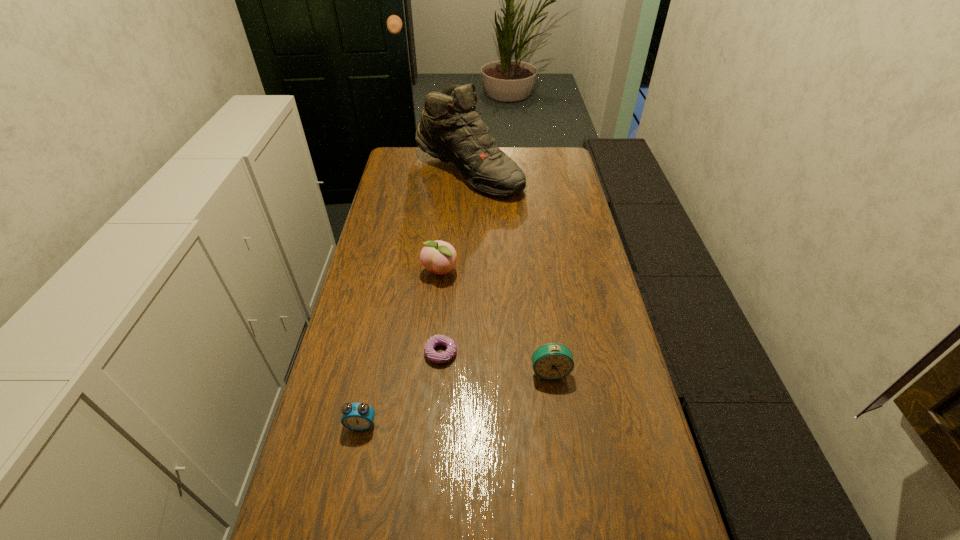
This screenshot has height=540, width=960. In the image, there is a desktop. Find the location of `vacant space at the far right corner`. vacant space at the far right corner is located at coordinates (536, 162).

At what (x,y) coordinates should I click in order to perform the action: click on free spot between the doughnut and the second farthest object. Please return your answer as a coordinate pair (x, y). Looking at the image, I should click on (440, 313).

At what (x,y) coordinates should I click in order to perform the action: click on free area in between the second farthest object and the doughnut. Please return your answer as a coordinate pair (x, y). This screenshot has height=540, width=960. Looking at the image, I should click on (440, 313).

I want to click on free space between the second farthest object and the left alarm clock, so pyautogui.click(x=400, y=348).

Where is `vacant area that lies between the taller alarm clock and the farthest object`? This screenshot has width=960, height=540. vacant area that lies between the taller alarm clock and the farthest object is located at coordinates (509, 272).

I want to click on vacant area that lies between the farthest object and the taller alarm clock, so click(x=509, y=272).

Where is `vacant space that's between the right alarm clock and the left alarm clock`? vacant space that's between the right alarm clock and the left alarm clock is located at coordinates (456, 398).

This screenshot has height=540, width=960. In order to click on free point between the fourth nearest object and the shortest object in this screenshot , I will do `click(440, 313)`.

Image resolution: width=960 pixels, height=540 pixels. I want to click on vacant space in between the nearest object and the farther alarm clock, so click(x=456, y=398).

Where is `vacant space in between the left alarm clock and the second farthest object`? Image resolution: width=960 pixels, height=540 pixels. vacant space in between the left alarm clock and the second farthest object is located at coordinates (400, 348).